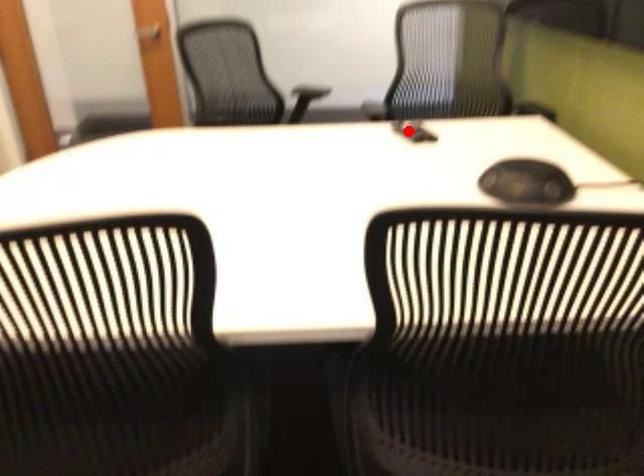
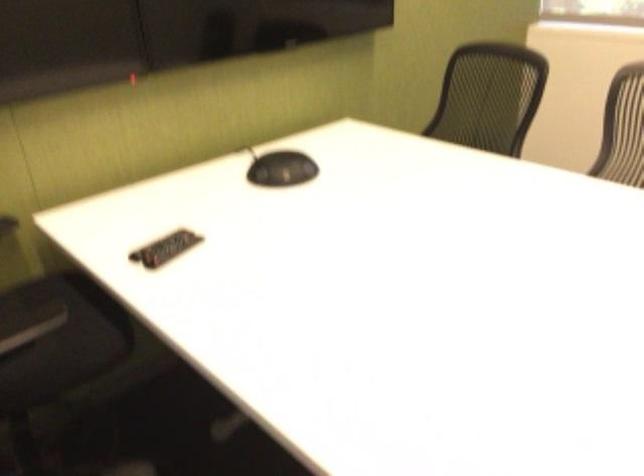
Where in the second image is the point corresponding to the highlighted location from the first image?

(165, 248)